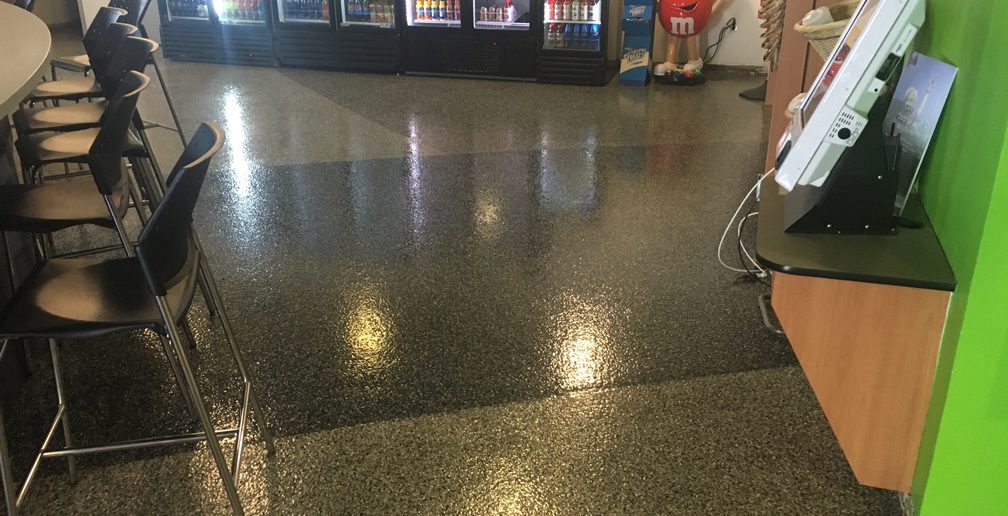
The width and height of the screenshot is (1008, 516). Find the location of `wires`. wires is located at coordinates (737, 203), (740, 217).